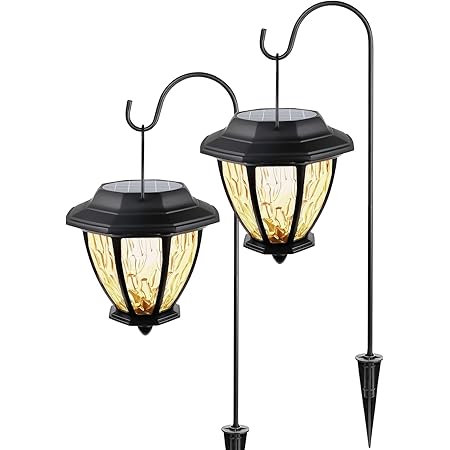
In order to click on handle of lamp in this screenshot , I will do `click(276, 114)`.